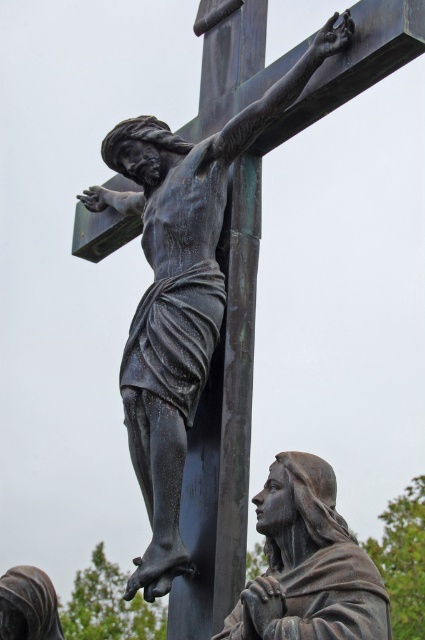
Does bronze statue at center lie behind bronze statue at lower right?

Yes, it is.

Is point (175, 180) farther from camera compared to point (300, 584)?

That is True.

Where is `bronze statue at center`? Image resolution: width=425 pixels, height=640 pixels. bronze statue at center is located at coordinates (195, 168).

Where is `bronze statue at center`? The width and height of the screenshot is (425, 640). bronze statue at center is located at coordinates (195, 168).

Does bronze cross at center come in front of bronze statue at center?

That is True.

This screenshot has width=425, height=640. In order to click on bronze cross at center in this screenshot , I will do `click(221, 429)`.

Find the location of a particular element. The image size is (425, 640). bronze cross at center is located at coordinates (221, 429).

Who is higher up, bronze cross at center or bronze statue at lower right?

bronze cross at center is higher up.

Identify the location of bronze cross at center. (221, 429).